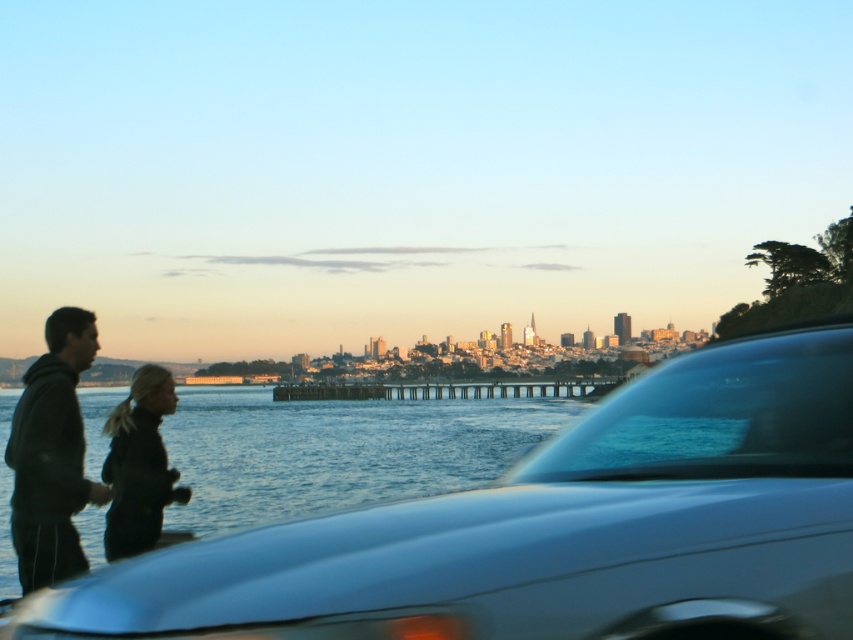
Based on the photo, which of these two, satin silver car at center or black matte jacket at lower left, stands shorter?

With less height is black matte jacket at lower left.

Can you confirm if satin silver car at center is wider than black matte jacket at lower left?

Yes, satin silver car at center is wider than black matte jacket at lower left.

Between point (804, 612) and point (131, 413), which one is positioned behind?

The point (131, 413) is behind.

What are the coordinates of `satin silver car at center` in the screenshot? It's located at (552, 529).

Is point (50, 424) positioned in front of point (166, 401)?

Yes, it is in front of point (166, 401).

This screenshot has width=853, height=640. Describe the element at coordinates (51, 454) in the screenshot. I see `black matte jacket at left` at that location.

What are the coordinates of `black matte jacket at left` in the screenshot? It's located at (51, 454).

Can you confirm if satin silver car at center is taller than black matte jacket at left?

No, satin silver car at center is not taller than black matte jacket at left.

Can you confirm if satin silver car at center is wider than black matte jacket at left?

Indeed, satin silver car at center has a greater width compared to black matte jacket at left.

Which is behind, point (699, 554) or point (44, 429)?

The point (44, 429) is more distant.

The height and width of the screenshot is (640, 853). I want to click on satin silver car at center, so click(x=552, y=529).